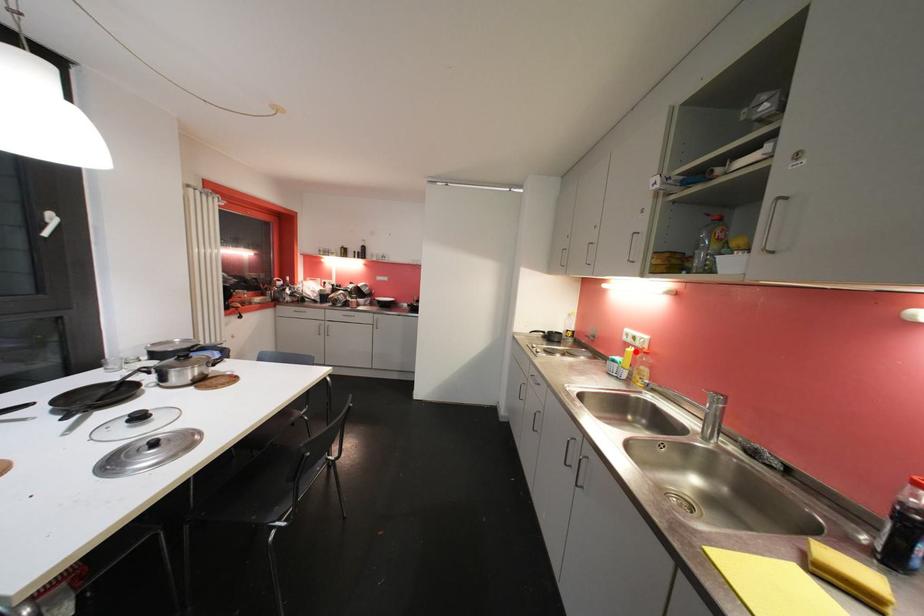
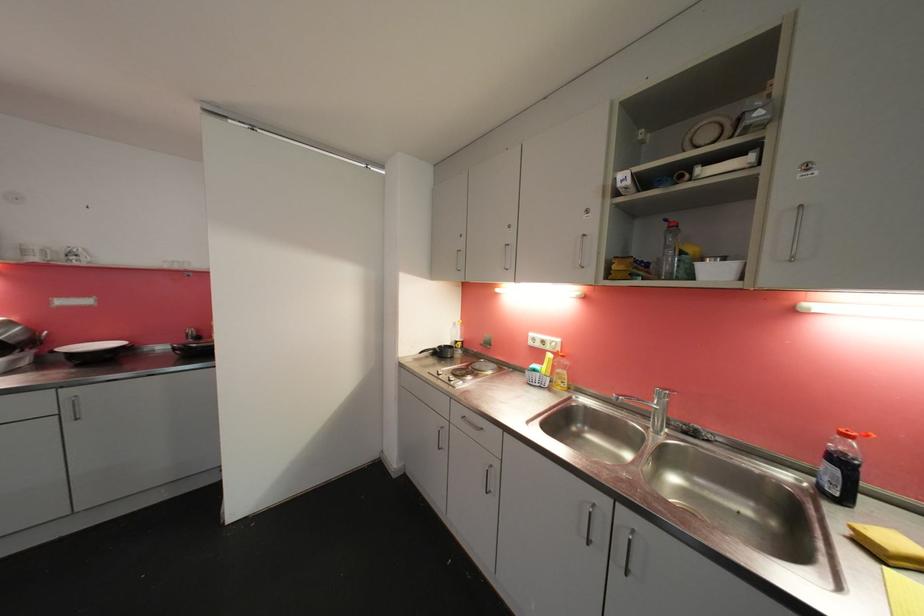
Where in the second image is the point corresponding to the highlighted location from the first image?

(554, 358)